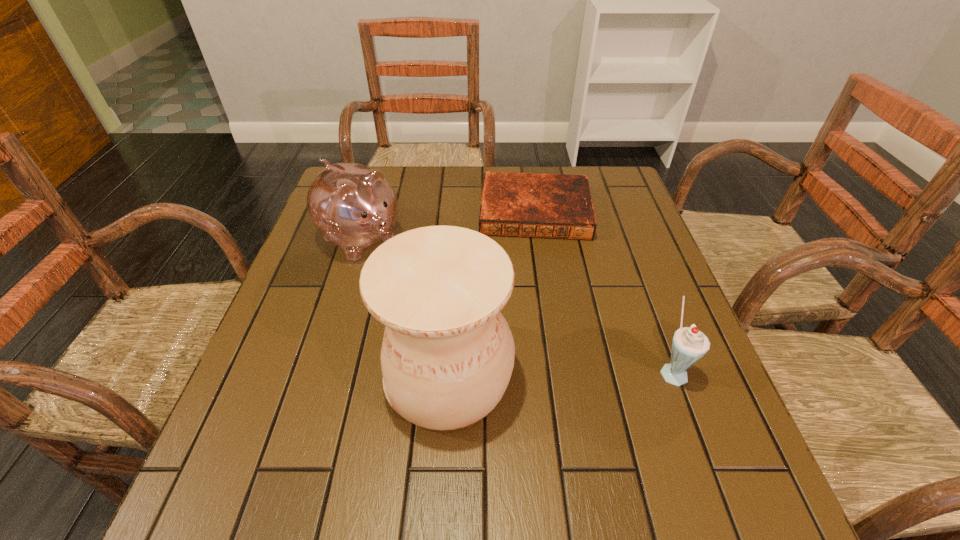
At what (x,y) coordinates should I click in order to perform the action: click on vacant spot on the desktop that is between the pottery and the milkshake and is positioned on the spine side of the shortest object. Please return your answer as a coordinate pair (x, y). Looking at the image, I should click on (540, 373).

At what (x,y) coordinates should I click in order to perform the action: click on vacant space on the desktop that is between the tallest object and the rightmost object and is positioned on the front facing side of the piggy bank. Please return your answer as a coordinate pair (x, y). The width and height of the screenshot is (960, 540). Looking at the image, I should click on (537, 373).